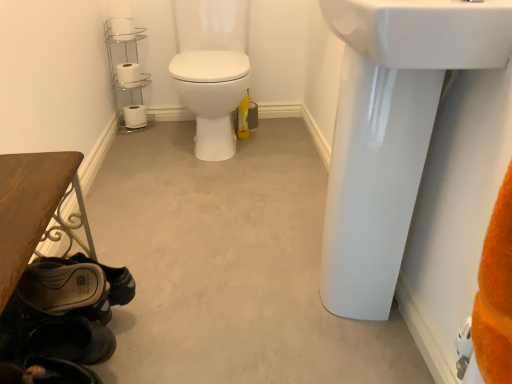
Question: From their relative heights in the image, would you say leather brown shoe at lower left, marked as the 1th shoe in a back-to-front arrangement, is taller or shorter than chrome/metallic toilet paper holder at upper left?

Choices:
 (A) short
 (B) tall

Answer: (A)

Question: Considering their positions, is leather brown shoe at lower left, the second shoe when ordered from front to back, located in front of or behind chrome/metallic toilet paper holder at upper left?

Choices:
 (A) behind
 (B) front

Answer: (B)

Question: Estimate the real-world distances between objects in this image. Which object is closer to the leather brown shoe at lower left, the second shoe when ordered from front to back?

Choices:
 (A) dark brown leather shoe at lower left, the second shoe when ordered from back to front
 (B) chrome/metallic toilet paper holder at upper left
 (C) white matte toilet paper at lower left, which is counted as the third toilet paper, starting from the front
 (D) leather brown shoe at lower left
 (E) white glossy sink at upper right, which is counted as the 2th sink, starting from the bottom

Answer: (D)

Question: Based on their relative distances, which object is farther from the white matte toilet paper at upper left, positioned as the second toilet paper in front-to-back order?

Choices:
 (A) white matte toilet paper at lower left, which is counted as the third toilet paper, starting from the front
 (B) white glossy sink at upper right, which is the 1th sink in top-to-bottom order
 (C) dark brown leather shoe at lower left, the second shoe when ordered from back to front
 (D) leather brown shoe at lower left, marked as the 1th shoe in a back-to-front arrangement
 (E) white glossy sink at upper right, the first sink in the bottom-to-top sequence

Answer: (B)